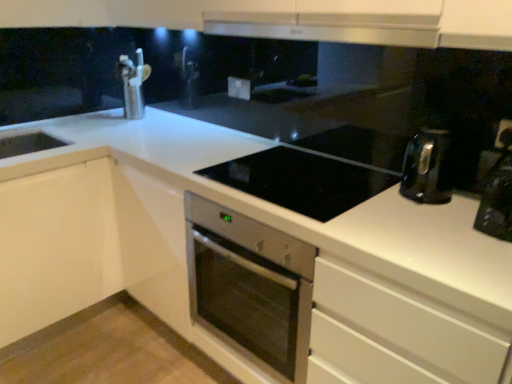
Find the location of `empty space that is ontop of black glass cooktop at center (from a real-world perspective)`. empty space that is ontop of black glass cooktop at center (from a real-world perspective) is located at coordinates (307, 179).